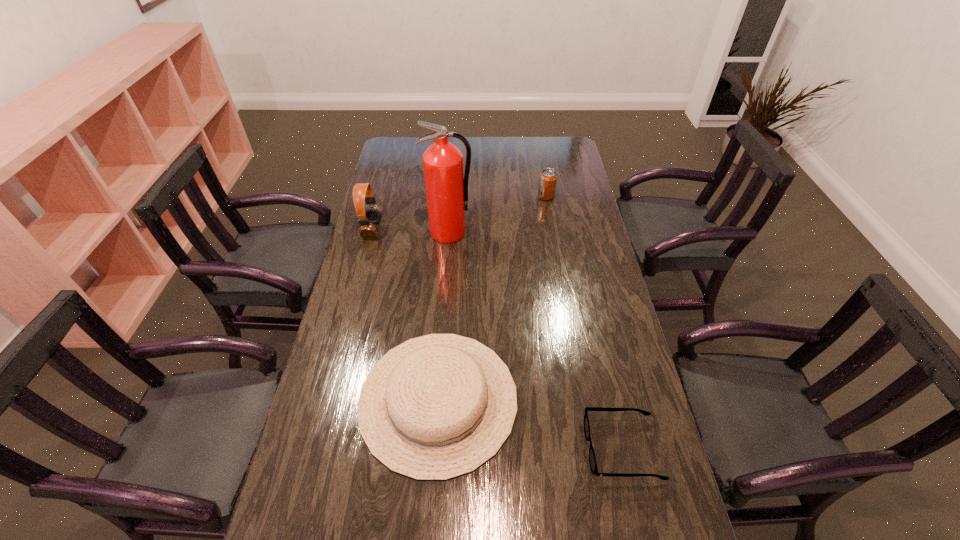
This screenshot has height=540, width=960. I want to click on the tallest object, so click(446, 185).

The image size is (960, 540). Find the location of `the leftmost object`. the leftmost object is located at coordinates (371, 215).

The width and height of the screenshot is (960, 540). I want to click on headset, so click(x=371, y=215).

The image size is (960, 540). In order to click on the farthest object in this screenshot , I will do `click(548, 178)`.

The width and height of the screenshot is (960, 540). I want to click on the third shortest object, so click(548, 178).

In order to click on the fourth tallest object in this screenshot , I will do `click(435, 407)`.

At what (x,y) coordinates should I click in order to perform the action: click on the shortest object. Please return your answer as a coordinate pair (x, y). This screenshot has width=960, height=540. Looking at the image, I should click on (592, 459).

This screenshot has width=960, height=540. In order to click on vacant region located at the nozzle of the tallest object in this screenshot , I will do `click(444, 302)`.

This screenshot has width=960, height=540. What are the coordinates of `vacant space situated 0.320m on the ear cups of the leftmost object` in the screenshot? It's located at (467, 230).

Identify the location of vacant space located 0.080m on the right of the farthest object. (574, 197).